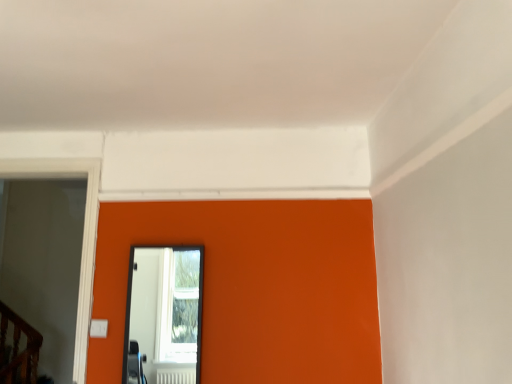
Question: Does transparent glass door at left have a larger size compared to black glass mirror at center?

Choices:
 (A) no
 (B) yes

Answer: (B)

Question: From the image's perspective, is transparent glass door at left located above black glass mirror at center?

Choices:
 (A) yes
 (B) no

Answer: (A)

Question: Is transparent glass door at left beside black glass mirror at center?

Choices:
 (A) yes
 (B) no

Answer: (B)

Question: Considering the relative sizes of transparent glass door at left and black glass mirror at center in the image provided, is transparent glass door at left smaller than black glass mirror at center?

Choices:
 (A) yes
 (B) no

Answer: (B)

Question: Can you confirm if transparent glass door at left is thinner than black glass mirror at center?

Choices:
 (A) no
 (B) yes

Answer: (A)

Question: Can you confirm if transparent glass door at left is shorter than black glass mirror at center?

Choices:
 (A) yes
 (B) no

Answer: (B)

Question: Is black glass mirror at center shorter than transparent glass door at left?

Choices:
 (A) yes
 (B) no

Answer: (A)

Question: Does black glass mirror at center have a greater height compared to transparent glass door at left?

Choices:
 (A) no
 (B) yes

Answer: (A)

Question: Is black glass mirror at center not close to transparent glass door at left?

Choices:
 (A) yes
 (B) no

Answer: (A)

Question: Does black glass mirror at center have a lesser width compared to transparent glass door at left?

Choices:
 (A) yes
 (B) no

Answer: (A)

Question: From the image's perspective, does black glass mirror at center appear higher than transparent glass door at left?

Choices:
 (A) no
 (B) yes

Answer: (A)

Question: Is black glass mirror at center at the right side of transparent glass door at left?

Choices:
 (A) yes
 (B) no

Answer: (A)

Question: Is transparent glass door at left wider or thinner than black glass mirror at center?

Choices:
 (A) wide
 (B) thin

Answer: (A)